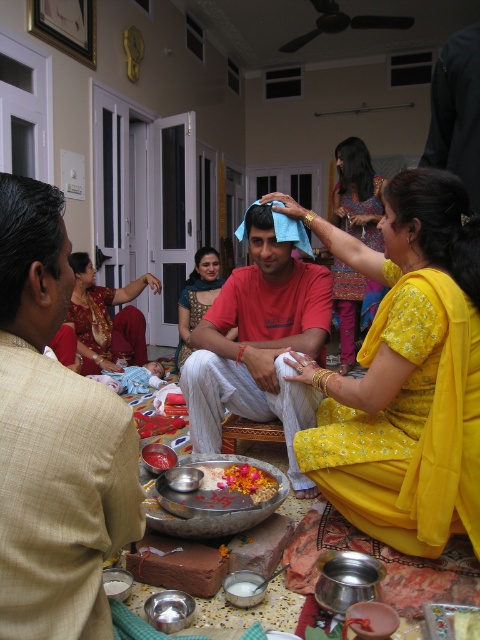
Question: Where is printed cotton saree at upper right located in relation to metallic silver bowl at center in the image?

Choices:
 (A) right
 (B) left

Answer: (A)

Question: Which object appears closest to the camera in this image?

Choices:
 (A) floral decoration at center
 (B) matte red saree at left
 (C) matte red shirt at center

Answer: (A)

Question: Which point is closer to the camera?

Choices:
 (A) (112, 429)
 (B) (478, 406)
 (C) (245, 384)
 (D) (181, 339)

Answer: (A)

Question: Estimate the real-world distances between objects in this image. Which object is closer to the matte red shirt at center?

Choices:
 (A) yellow floral fabric at center
 (B) matte red saree at left
 (C) yellow floral saree at center
 (D) metallic silver bowl at center

Answer: (A)

Question: Is matte red shirt at center thinner than printed cotton saree at upper right?

Choices:
 (A) no
 (B) yes

Answer: (A)

Question: Does floral decoration at center have a lesser width compared to metallic silver bowl at center?

Choices:
 (A) no
 (B) yes

Answer: (A)